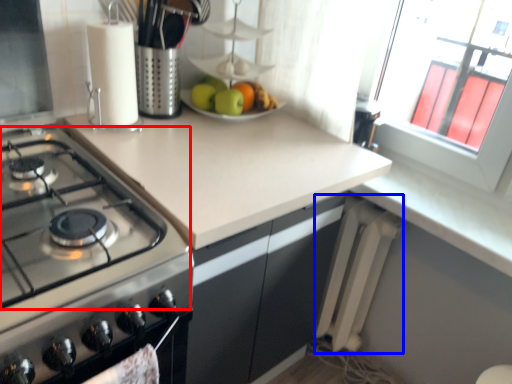
Question: Which point is closer to the camera, gas stove (highlighted by a red box) or radiator (highlighted by a blue box)?

Choices:
 (A) gas stove
 (B) radiator

Answer: (A)